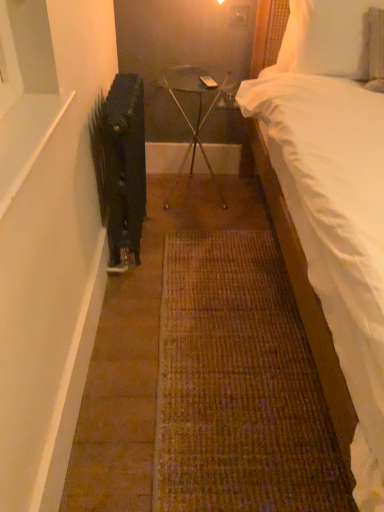
Question: From a real-world perspective, relative to black matte radiator at left, is white soft pillow at upper right vertically above or below?

Choices:
 (A) below
 (B) above

Answer: (B)

Question: Is white soft pillow at upper right wider or thinner than black matte radiator at left?

Choices:
 (A) wide
 (B) thin

Answer: (B)

Question: Which of these objects is positioned farthest from the white soft bed at right?

Choices:
 (A) black matte radiator at left
 (B) white soft pillow at upper right
 (C) metallic glass table at center

Answer: (C)

Question: Which object is the farthest from the metallic glass table at center?

Choices:
 (A) black matte radiator at left
 (B) white soft pillow at upper right
 (C) white soft bed at right

Answer: (C)